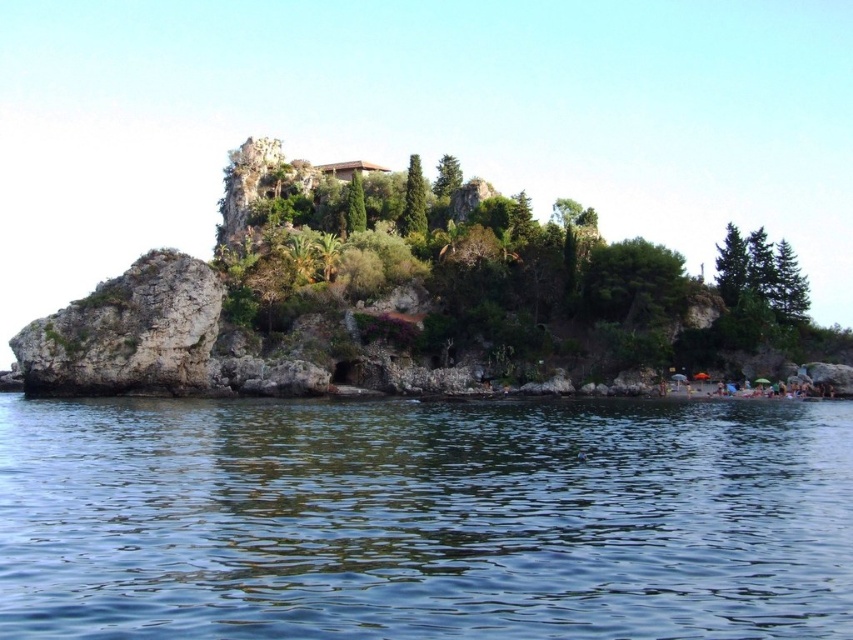
Can you confirm if clear blue water at lower center is shorter than rocky cliff at left?

Correct, clear blue water at lower center is not as tall as rocky cliff at left.

Is clear blue water at lower center closer to the viewer compared to rocky cliff at left?

Yes, clear blue water at lower center is closer to the viewer.

Image resolution: width=853 pixels, height=640 pixels. I want to click on clear blue water at lower center, so (x=424, y=518).